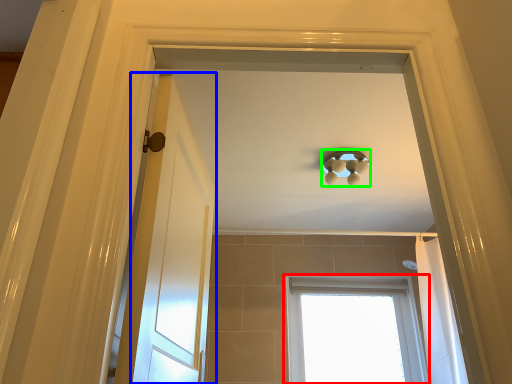
Question: Estimate the real-world distances between objects in this image. Which object is farther from window (highlighted by a red box), door (highlighted by a blue box) or lamp (highlighted by a green box)?

Choices:
 (A) door
 (B) lamp

Answer: (A)